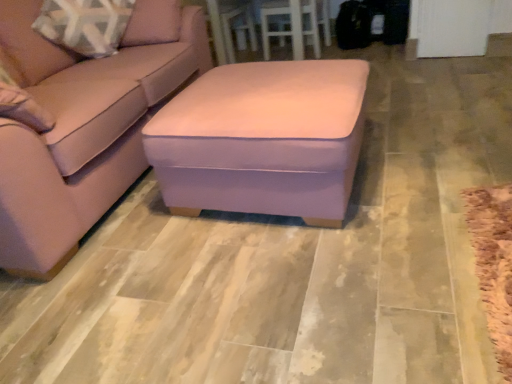
Question: Is pink velvet ottoman at center not close to suede pink ottoman at center?

Choices:
 (A) yes
 (B) no

Answer: (B)

Question: Considering the relative sizes of pink velvet ottoman at center and suede pink ottoman at center in the image provided, is pink velvet ottoman at center smaller than suede pink ottoman at center?

Choices:
 (A) no
 (B) yes

Answer: (B)

Question: Can you confirm if pink velvet ottoman at center is taller than suede pink ottoman at center?

Choices:
 (A) no
 (B) yes

Answer: (A)

Question: Does pink velvet ottoman at center lie behind suede pink ottoman at center?

Choices:
 (A) no
 (B) yes

Answer: (B)

Question: Is pink velvet ottoman at center at the right side of suede pink ottoman at center?

Choices:
 (A) no
 (B) yes

Answer: (B)

Question: Would you say suede pink ottoman at center is part of pink velvet ottoman at center's contents?

Choices:
 (A) yes
 (B) no

Answer: (B)

Question: Is suede pink ottoman at center bigger than white wood table at upper center?

Choices:
 (A) no
 (B) yes

Answer: (B)

Question: Are suede pink ottoman at center and white wood table at upper center making contact?

Choices:
 (A) no
 (B) yes

Answer: (A)

Question: From a real-world perspective, is suede pink ottoman at center located higher than white wood table at upper center?

Choices:
 (A) no
 (B) yes

Answer: (B)

Question: Is suede pink ottoman at center to the right of white wood table at upper center from the viewer's perspective?

Choices:
 (A) yes
 (B) no

Answer: (B)

Question: Considering the relative sizes of suede pink ottoman at center and white wood table at upper center in the image provided, is suede pink ottoman at center smaller than white wood table at upper center?

Choices:
 (A) yes
 (B) no

Answer: (B)

Question: From the image's perspective, does suede pink ottoman at center appear higher than white wood table at upper center?

Choices:
 (A) no
 (B) yes

Answer: (A)

Question: Can you confirm if white wood table at upper center is shorter than pink velvet ottoman at center?

Choices:
 (A) yes
 (B) no

Answer: (B)